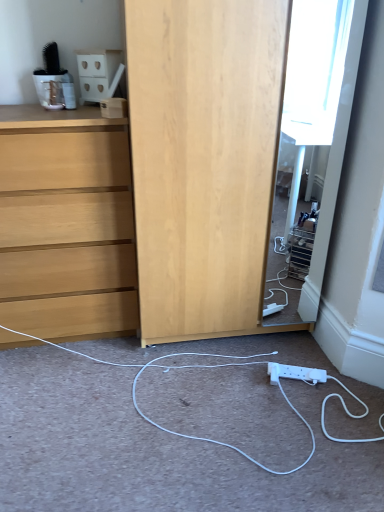
I want to click on vacant space in front of light wood chest of drawers at left, so click(x=69, y=396).